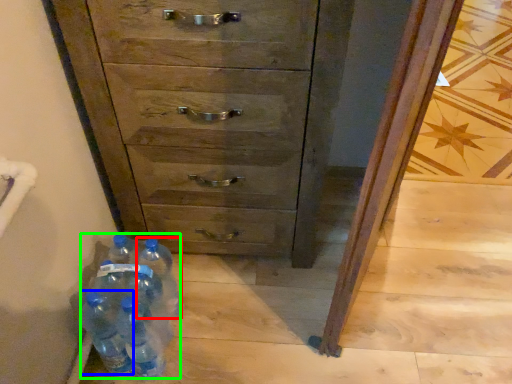
Question: Which is nearer to the bottle (highlighted by a red box)? bottle (highlighted by a blue box) or bottle (highlighted by a green box).

Choices:
 (A) bottle
 (B) bottle

Answer: (B)